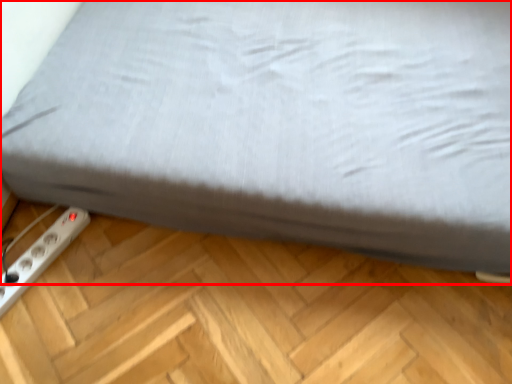
Question: Observing the image, what is the correct spatial positioning of bed (annotated by the red box) in reference to power plugs and sockets?

Choices:
 (A) left
 (B) right

Answer: (B)